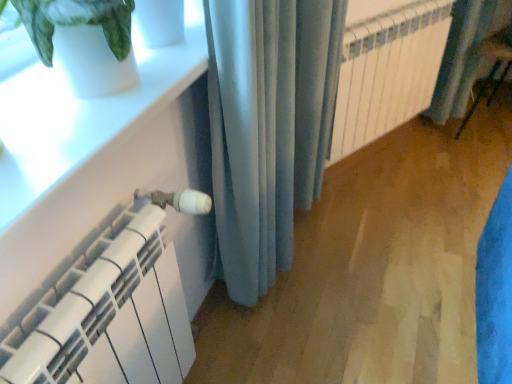
Question: Considering the positions of white matte heater at lower left and white glossy window sill at upper left in the image, is white matte heater at lower left bigger or smaller than white glossy window sill at upper left?

Choices:
 (A) small
 (B) big

Answer: (B)

Question: From the image's perspective, relative to white glossy window sill at upper left, is white matte heater at lower left above or below?

Choices:
 (A) above
 (B) below

Answer: (B)

Question: Which object is the closest to the white metallic radiator at center?

Choices:
 (A) satin blue curtain at center, the first curtain from the front
 (B) white glossy window sill at upper left
 (C) blue fabric curtain at right, which is the 1th curtain from back to front
 (D) white matte heater at lower left

Answer: (C)

Question: Which of these objects is positioned closest to the white metallic radiator at center?

Choices:
 (A) satin blue curtain at center, the second curtain in the back-to-front sequence
 (B) white glossy window sill at upper left
 (C) white matte heater at lower left
 (D) blue fabric curtain at right, which is the 1th curtain from right to left

Answer: (D)